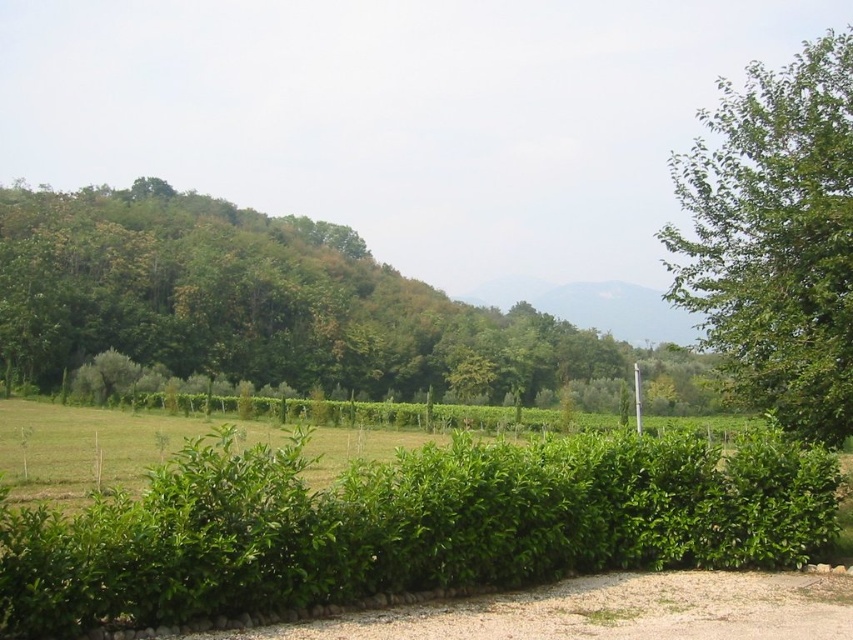
Question: Which point appears closest to the camera in this image?

Choices:
 (A) (193, 577)
 (B) (827, 205)

Answer: (A)

Question: Is green leafy hedge at center bigger than green leafy tree at upper left?

Choices:
 (A) yes
 (B) no

Answer: (B)

Question: Which point appears closest to the camera in this image?

Choices:
 (A) (639, 563)
 (B) (786, 113)
 (C) (231, 275)

Answer: (A)

Question: Does green leafy hedge at center appear on the right side of green leafy tree at right?

Choices:
 (A) yes
 (B) no

Answer: (B)

Question: Which point is closer to the camera?

Choices:
 (A) (799, 115)
 (B) (608, 458)
 (C) (416, 365)

Answer: (B)

Question: Is green leafy hedge at center closer to camera compared to green leafy tree at upper left?

Choices:
 (A) yes
 (B) no

Answer: (A)